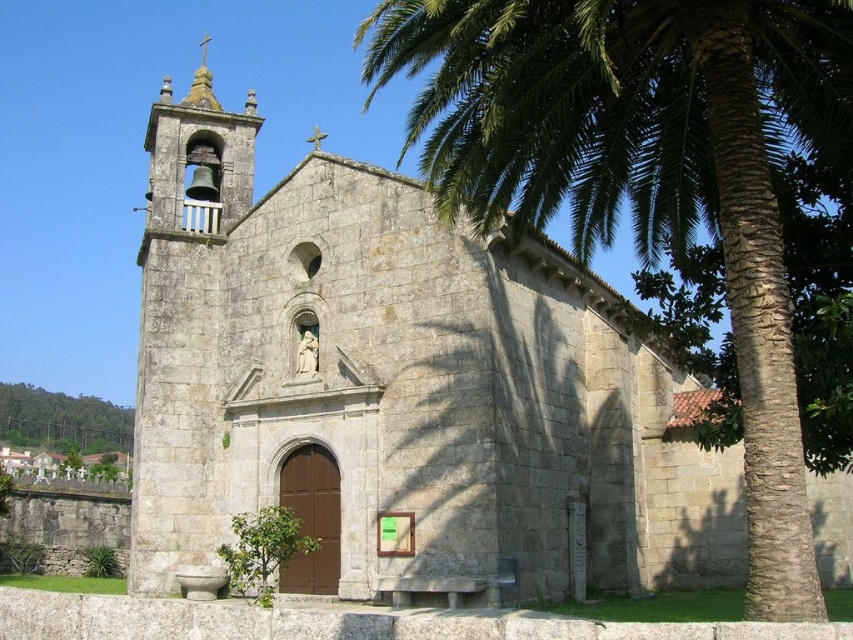
Question: Can you confirm if green leafy palm tree at center is bigger than green leafy tree at upper left?

Choices:
 (A) no
 (B) yes

Answer: (B)

Question: Is green leafy palm tree at center below green leafy tree at upper left?

Choices:
 (A) yes
 (B) no

Answer: (B)

Question: Can you confirm if green leafy palm tree at center is positioned to the left of green leafy tree at upper left?

Choices:
 (A) no
 (B) yes

Answer: (A)

Question: Which point is farther to the camera?

Choices:
 (A) (764, 211)
 (B) (16, 385)

Answer: (B)